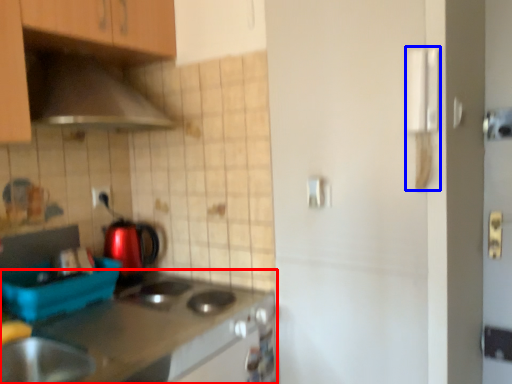
Question: Which of the following is the closest to the observer, countertop (highlighted by a red box) or door handle (highlighted by a blue box)?

Choices:
 (A) countertop
 (B) door handle

Answer: (A)